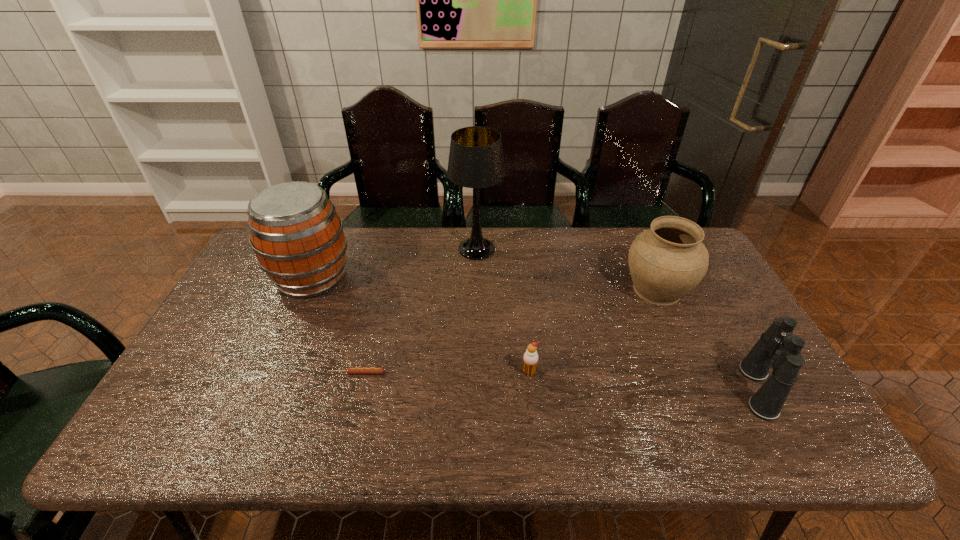
This screenshot has width=960, height=540. What are the coordinates of `the closest object to the fourth object from right to left` in the screenshot? It's located at (297, 236).

Identify the location of vacant point that satisfies the following two spatial constraints: 1. on the front side of the binoculars; 2. on the left side of the shortest object. (352, 389).

You are a GUI agent. You are given a task and a screenshot of the screen. Output one action in this format:
    pyautogui.click(x=<x>, y=<y>)
    Task: Click on the free region that satisfies the following two spatial constraints: 1. at the front with a straw on the icecream; 2. on the right side of the binoculars
    The width and height of the screenshot is (960, 540).
    Given the screenshot: What is the action you would take?
    pyautogui.click(x=531, y=389)